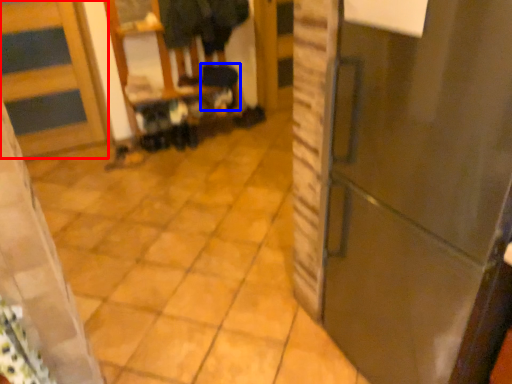
Question: Which object is closer to the camera taking this photo, door (highlighted by a red box) or step stool (highlighted by a blue box)?

Choices:
 (A) door
 (B) step stool

Answer: (A)